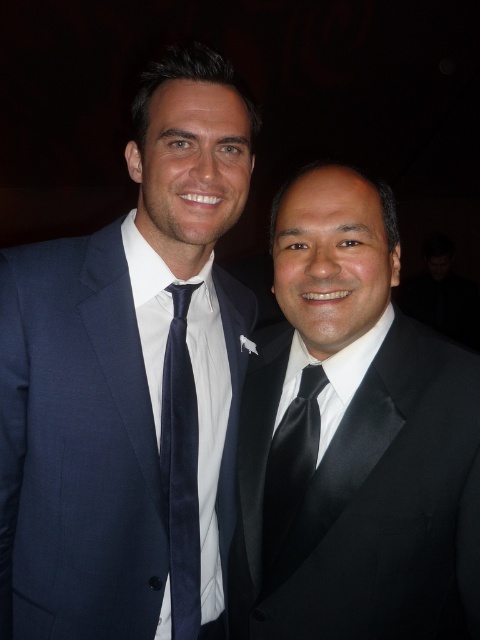
Describe the element at coordinates (356, 436) in the screenshot. The width and height of the screenshot is (480, 640). I see `black satin suit at right` at that location.

Does black satin suit at right have a larger size compared to black satin tie at center?

Correct, black satin suit at right is larger in size than black satin tie at center.

What do you see at coordinates (356, 436) in the screenshot? The width and height of the screenshot is (480, 640). I see `black satin suit at right` at bounding box center [356, 436].

The width and height of the screenshot is (480, 640). Identify the location of black satin suit at right. (356, 436).

Which is behind, point (189, 312) or point (478, 477)?

The point (189, 312) is more distant.

Describe the element at coordinates (131, 385) in the screenshot. Image resolution: width=480 pixels, height=640 pixels. I see `navy blue suit at left` at that location.

Identify the location of navy blue suit at left. (131, 385).

Is navy velvet tie at center in front of black satin tie at center?

No, navy velvet tie at center is behind black satin tie at center.

In order to click on navy velvet tie at center in this screenshot , I will do `click(180, 470)`.

This screenshot has width=480, height=640. What are the coordinates of `navy velvet tie at center` in the screenshot? It's located at (180, 470).